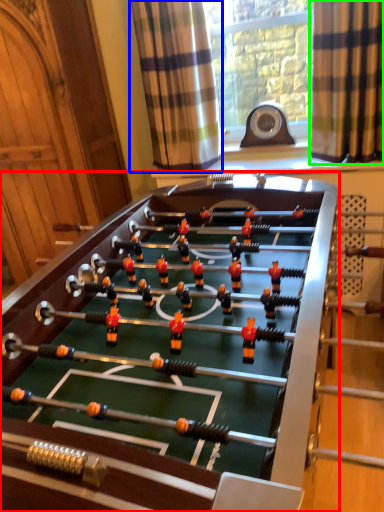
Question: Based on their relative distances, which object is nearer to table (highlighted by a red box)? Choose from curtain (highlighted by a blue box) and curtain (highlighted by a green box).

Choices:
 (A) curtain
 (B) curtain

Answer: (A)